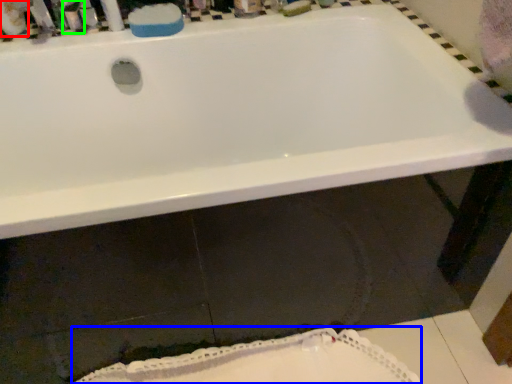
Question: Based on their relative distances, which object is farther from mouthwash (highlighted by a red box)? Choose from bath mat (highlighted by a blue box) and toiletry (highlighted by a green box).

Choices:
 (A) bath mat
 (B) toiletry

Answer: (A)